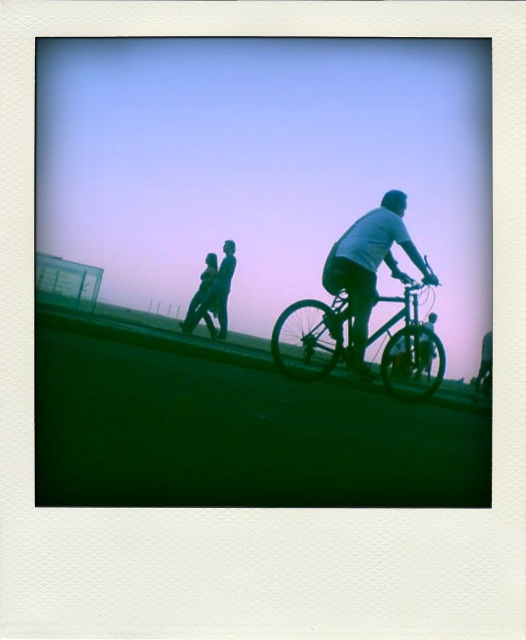
You are a pedestrian standing on the path and want to walk towards the direction of the matte white shirt at right. Is the metallic silver bicycle at center blocking your path?

The metallic silver bicycle at center is in front of the matte white shirt at right, so it is blocking the path between you and the matte white shirt at right.

You are standing on the path and want to take a photo of both the metallic silver bicycle at center and the matte white shirt at right. Which object should you position closer to the center of your camera frame to ensure both are in the shot?

Position the metallic silver bicycle at center closer to the center of your camera frame because it is already located to the right of the matte white shirt at right, so centering the bicycle would help include both in the frame.

You are standing on the path and want to know if you can safely walk between the metallic silver bicycle at center and the matte white shirt at right without getting too close. The recommended safe distance for social distancing is 6 feet. Can you fit through the space between them?

The distance between the metallic silver bicycle at center and the matte white shirt at right is 32.68 inches, which is approximately 2.72 feet. Since the recommended social distancing is 6 feet, the space is too narrow to safely walk between them without violating the distance requirement.